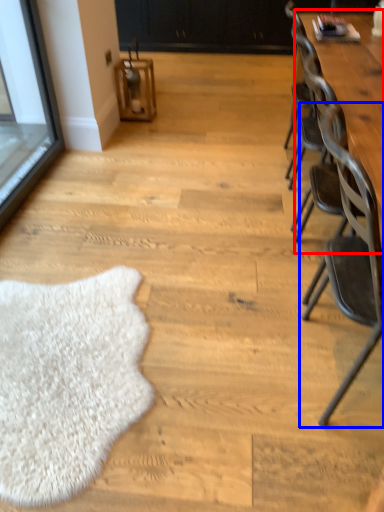
Question: Which of the following is the farthest to the observer, table (highlighted by a red box) or chair (highlighted by a blue box)?

Choices:
 (A) table
 (B) chair

Answer: (A)